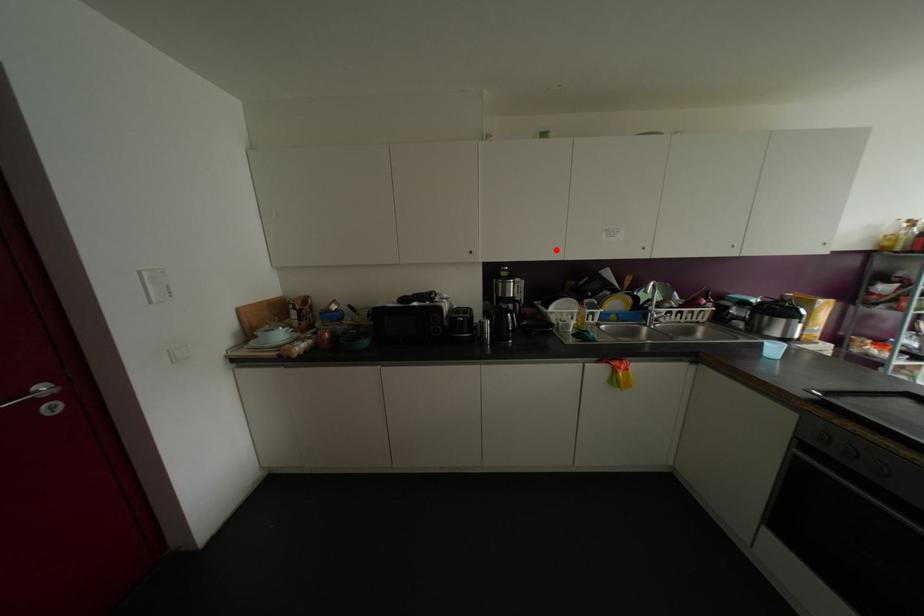
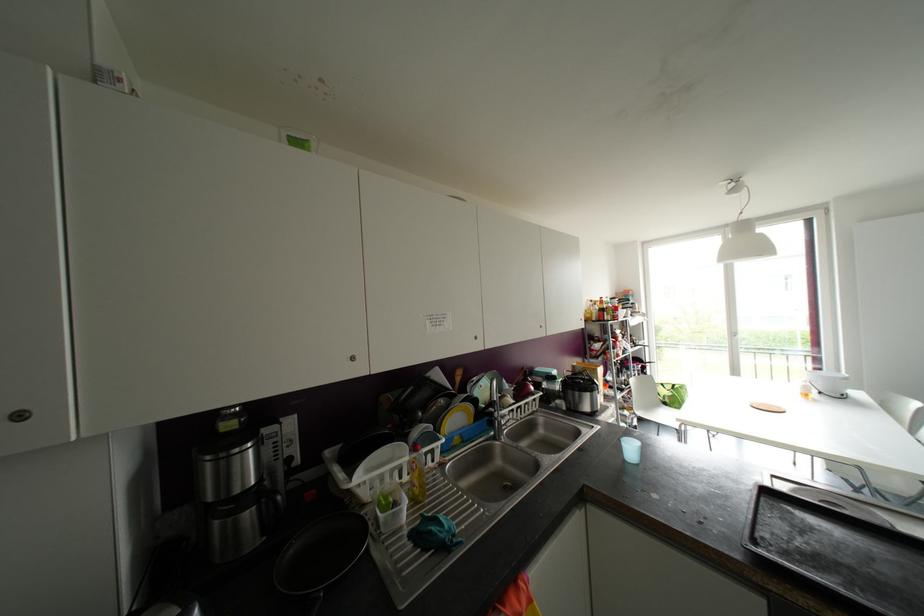
Where in the second image is the point corresponding to the highlighted location from the first image?

(351, 358)